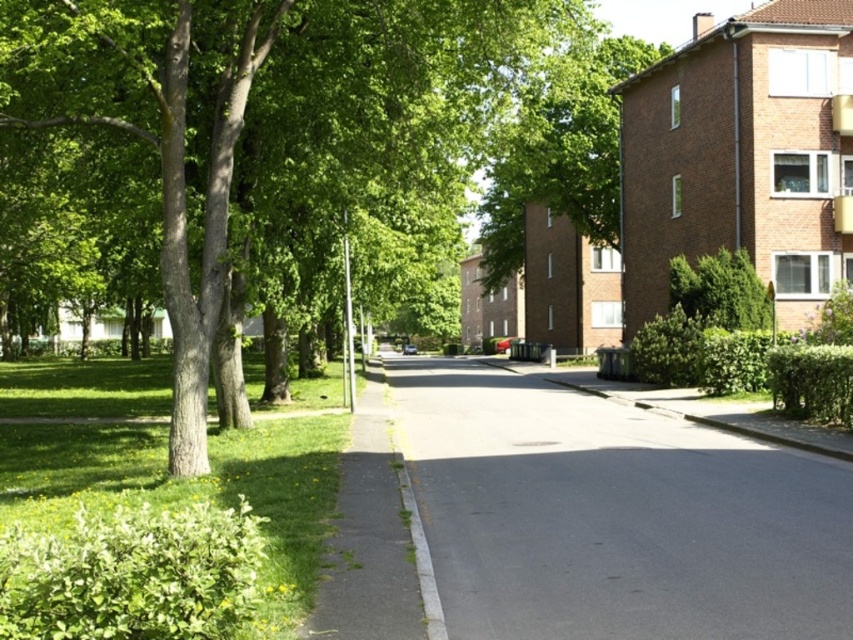
Question: Estimate the real-world distances between objects in this image. Which object is farther from the green leafy tree at left?

Choices:
 (A) green leafy tree at upper center
 (B) asphalt road at center

Answer: (B)

Question: Can you confirm if asphalt road at center is positioned above green leafy tree at upper center?

Choices:
 (A) yes
 (B) no

Answer: (B)

Question: In this image, where is asphalt road at center located relative to green leafy tree at upper center?

Choices:
 (A) below
 (B) above

Answer: (A)

Question: Which object is closer to the camera taking this photo?

Choices:
 (A) green leafy tree at upper center
 (B) asphalt road at center
 (C) green leafy tree at left

Answer: (B)

Question: Considering the real-world distances, which object is closest to the asphalt road at center?

Choices:
 (A) green leafy tree at left
 (B) green leafy tree at upper center

Answer: (A)

Question: Can you confirm if green leafy tree at left is positioned to the left of asphalt road at center?

Choices:
 (A) no
 (B) yes

Answer: (B)